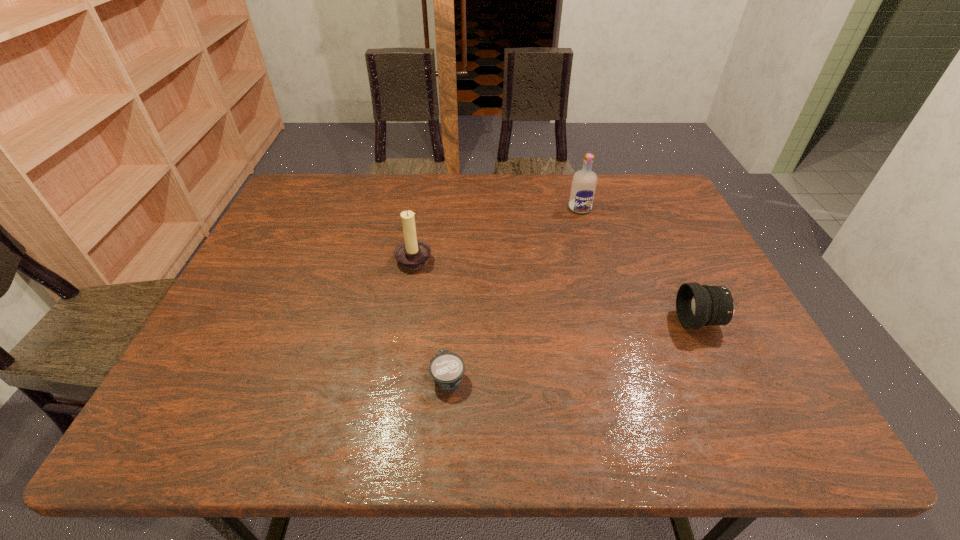
Locate an element on the screen. The image size is (960, 540). free spot between the third object from left to right and the nearest object is located at coordinates (514, 293).

Select which object appears as the third closest to the second nearest object. Please provide its 2D coordinates. Your answer should be formatted as a tuple, i.e. [(x, y)], where the tuple contains the x and y coordinates of a point satisfying the conditions above.

[(413, 254)]

Find the location of a particular element. The width and height of the screenshot is (960, 540). object identified as the third closest to the shortest object is located at coordinates (584, 182).

Identify the location of vacant space that satisfies the following two spatial constraints: 1. on the back side of the shortest object; 2. on the wick of the third nearest object. Image resolution: width=960 pixels, height=540 pixels. (455, 258).

I want to click on vacant area that satisfies the following two spatial constraints: 1. on the label of the vodka; 2. on the wick of the candle holder, so click(x=594, y=258).

Identify the location of vacant space that satisfies the following two spatial constraints: 1. on the wick of the leftmost object; 2. on the left side of the yogurt. (395, 377).

Identify the location of free space that satisfies the following two spatial constraints: 1. on the wick of the candle holder; 2. on the back side of the shortest object. (395, 377).